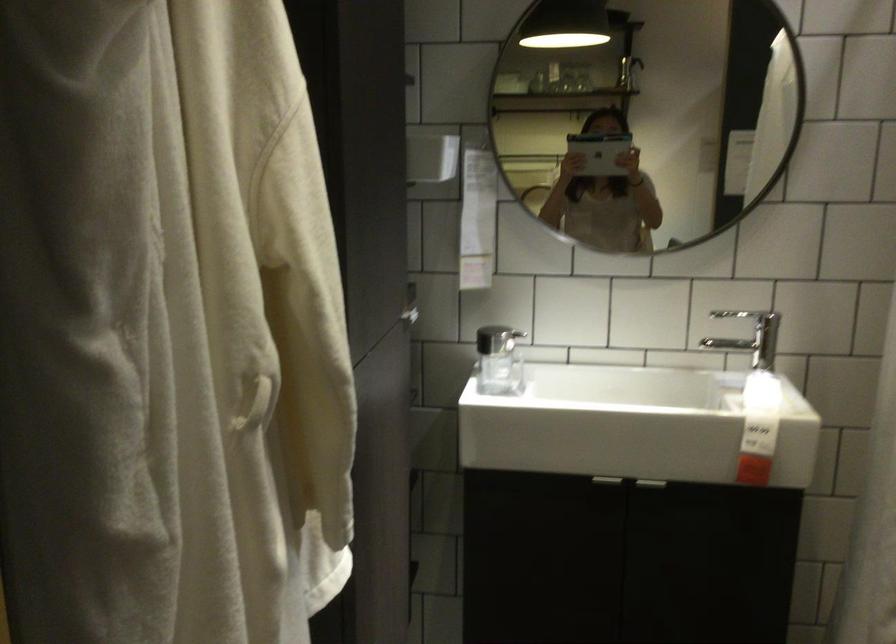
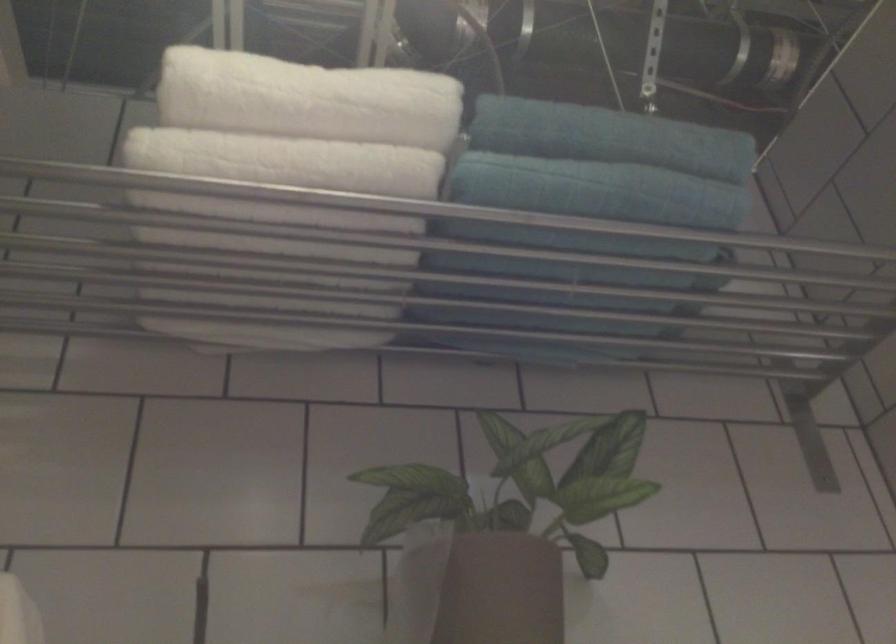
Based on the continuous images, in which direction is the camera rotating?

The camera rotated toward left-up.